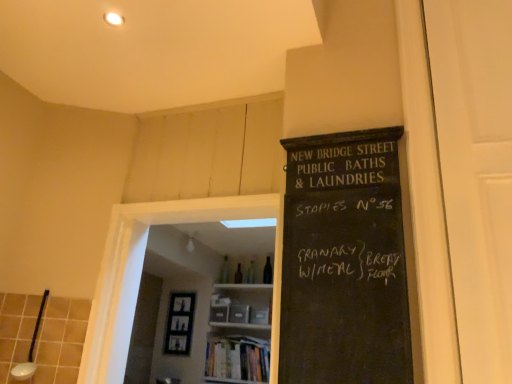
Question: Does wooden bookshelf at center have a greater width compared to white ceramic spoon at lower left?

Choices:
 (A) no
 (B) yes

Answer: (B)

Question: From a real-world perspective, is wooden bookshelf at center over white ceramic spoon at lower left?

Choices:
 (A) yes
 (B) no

Answer: (A)

Question: Is wooden bookshelf at center next to white ceramic spoon at lower left and touching it?

Choices:
 (A) no
 (B) yes

Answer: (A)

Question: Considering the relative positions of wooden bookshelf at center and white ceramic spoon at lower left in the image provided, is wooden bookshelf at center to the left of white ceramic spoon at lower left from the viewer's perspective?

Choices:
 (A) yes
 (B) no

Answer: (B)

Question: Is wooden bookshelf at center thinner than white ceramic spoon at lower left?

Choices:
 (A) yes
 (B) no

Answer: (B)

Question: Does wooden bookshelf at center have a lesser height compared to white ceramic spoon at lower left?

Choices:
 (A) yes
 (B) no

Answer: (B)

Question: Can we say transparent glass door at center, acting as the 1th glass door starting from the back, lies outside hardcover books at center?

Choices:
 (A) yes
 (B) no

Answer: (A)

Question: Is hardcover books at center completely or partially inside transparent glass door at center, the 2th glass door viewed from the right?

Choices:
 (A) yes
 (B) no

Answer: (B)

Question: Is transparent glass door at center, acting as the 1th glass door starting from the back, positioned in front of hardcover books at center?

Choices:
 (A) no
 (B) yes

Answer: (B)

Question: Is transparent glass door at center, which is the first glass door in left-to-right order, facing away from hardcover books at center?

Choices:
 (A) yes
 (B) no

Answer: (A)

Question: Could you tell me if transparent glass door at center, the 2th glass door viewed from the right, is facing hardcover books at center?

Choices:
 (A) no
 (B) yes

Answer: (A)

Question: Considering the relative sizes of transparent glass door at center, the 2th glass door viewed from the right, and hardcover books at center in the image provided, is transparent glass door at center, the 2th glass door viewed from the right, thinner than hardcover books at center?

Choices:
 (A) no
 (B) yes

Answer: (B)

Question: Is hardcover books at center facing towards white ceramic spoon at lower left?

Choices:
 (A) yes
 (B) no

Answer: (A)